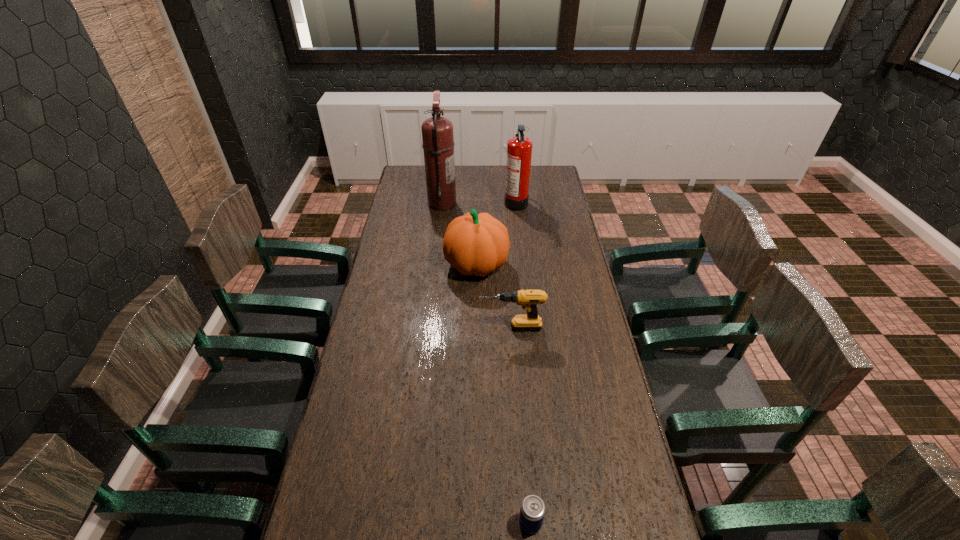
Image resolution: width=960 pixels, height=540 pixels. I want to click on the left fire extinguisher, so click(x=438, y=144).

Identify the location of the taller fire extinguisher. The height and width of the screenshot is (540, 960). click(x=438, y=144).

The width and height of the screenshot is (960, 540). Find the location of `the shorter fire extinguisher`. the shorter fire extinguisher is located at coordinates (519, 148).

At what (x,y) coordinates should I click in order to perform the action: click on the fourth shortest object. Please return your answer as a coordinate pair (x, y). This screenshot has height=540, width=960. Looking at the image, I should click on (519, 148).

The image size is (960, 540). In order to click on the third tallest object in this screenshot , I will do (476, 244).

This screenshot has width=960, height=540. What are the coordinates of `pumpkin` in the screenshot? It's located at (476, 244).

The height and width of the screenshot is (540, 960). Identify the location of drill. (529, 299).

Locate an element on the screen. The height and width of the screenshot is (540, 960). the fourth tallest object is located at coordinates (529, 299).

Find the location of a particular element. The height and width of the screenshot is (540, 960). the nearest object is located at coordinates (532, 511).

You are a GUI agent. You are given a task and a screenshot of the screen. Output one action in this format:
    pyautogui.click(x=<x>, y=<y>)
    Task: Click on the beer can
    The height and width of the screenshot is (540, 960).
    Given the screenshot: What is the action you would take?
    pyautogui.click(x=532, y=511)